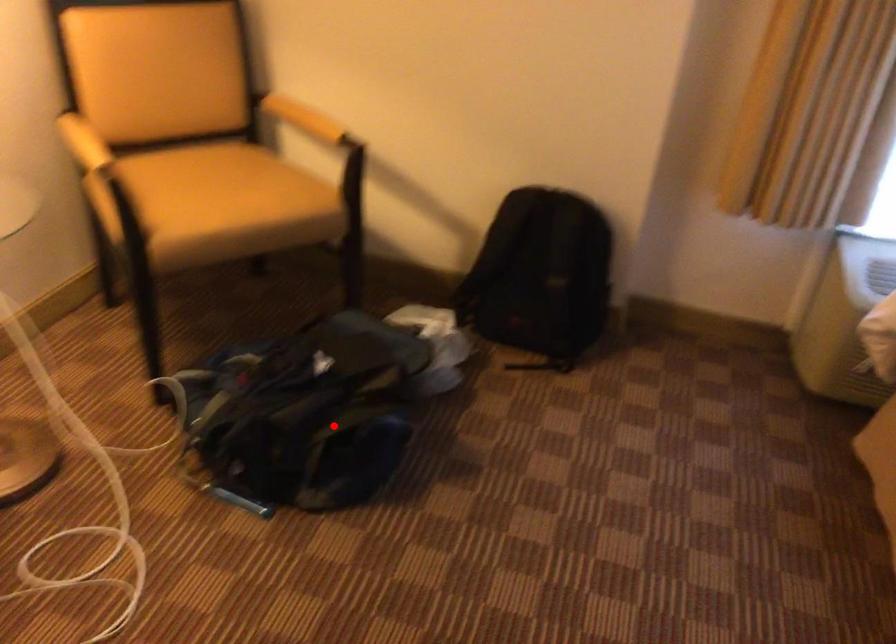
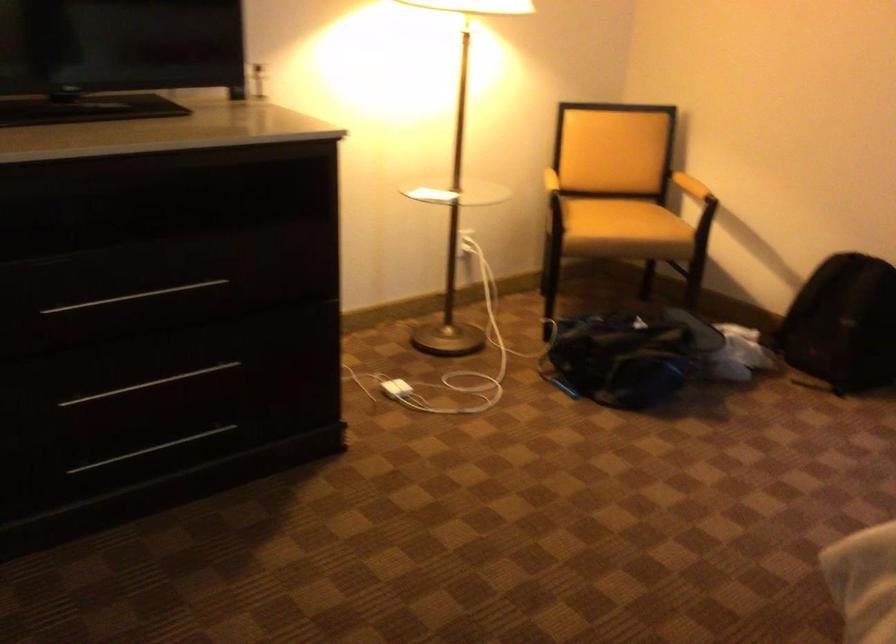
Where in the second image is the point corresponding to the highlighted location from the first image?

(627, 355)